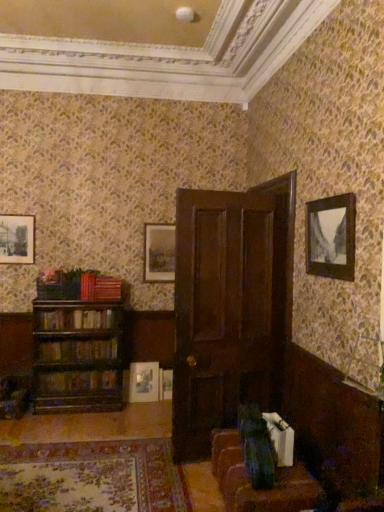
This screenshot has height=512, width=384. I want to click on blank space situated above wooden bookshelf at left, positioned as the third book in bottom-to-top order (from a real-world perspective), so click(87, 307).